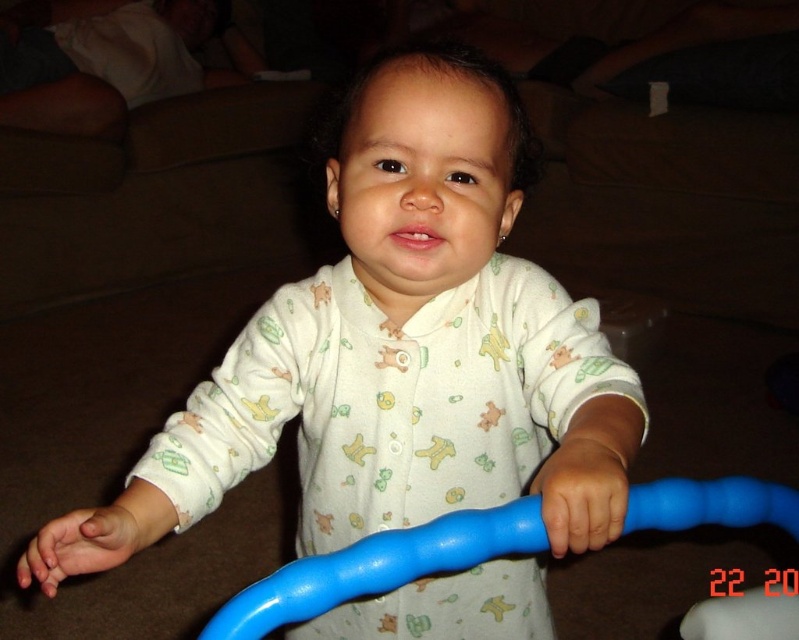
Question: Which object appears farthest from the camera in this image?

Choices:
 (A) blue rubber handle at center
 (B) white soft baby at center

Answer: (B)

Question: Which point is farther to the camera?

Choices:
 (A) (642, 525)
 (B) (169, 525)

Answer: (B)

Question: Is white soft baby at center thinner than blue rubber handle at center?

Choices:
 (A) yes
 (B) no

Answer: (B)

Question: Can you confirm if white soft baby at center is positioned to the left of blue rubber handle at center?

Choices:
 (A) yes
 (B) no

Answer: (A)

Question: Is white soft baby at center in front of blue rubber handle at center?

Choices:
 (A) no
 (B) yes

Answer: (A)